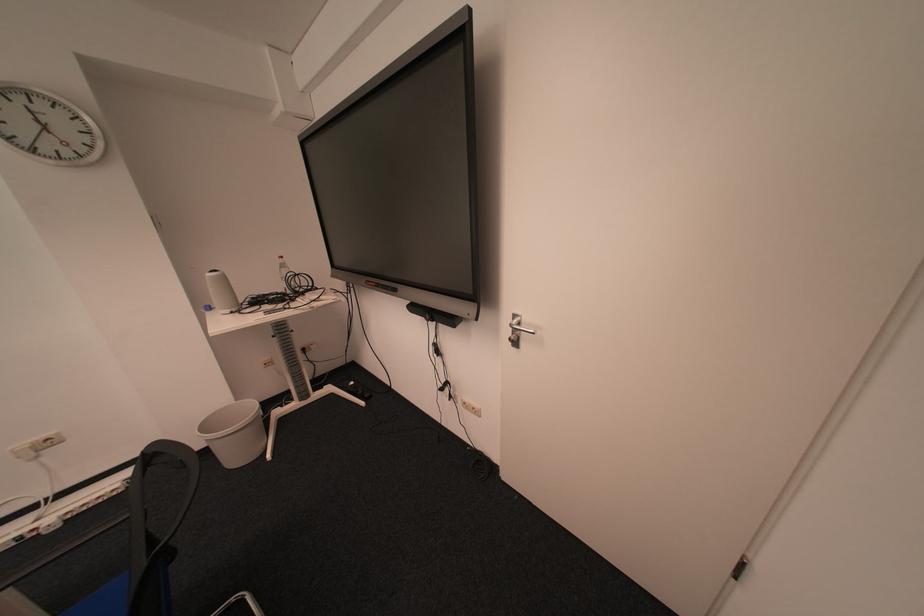
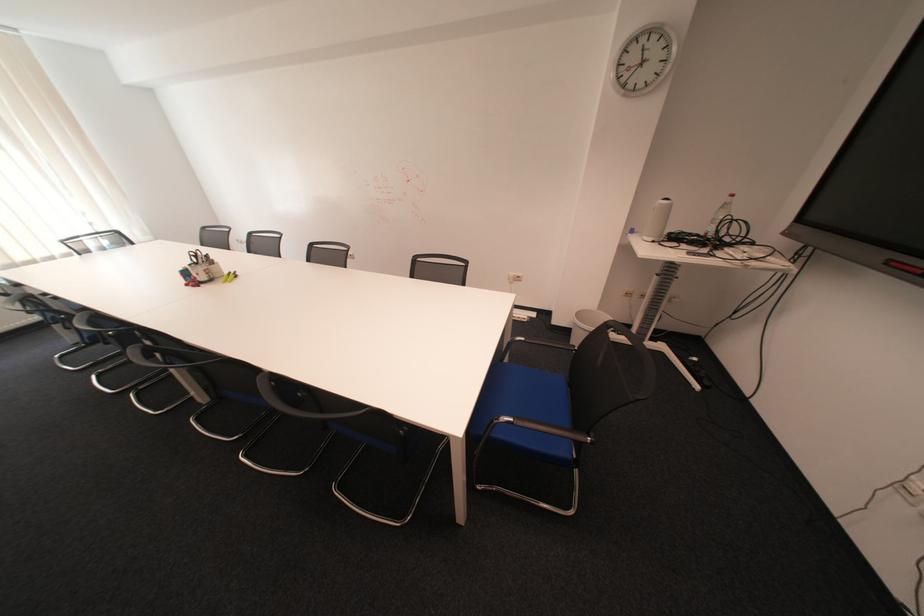
Where in the second image is the point corresponding to (x=292, y=286) from the first image?

(714, 229)